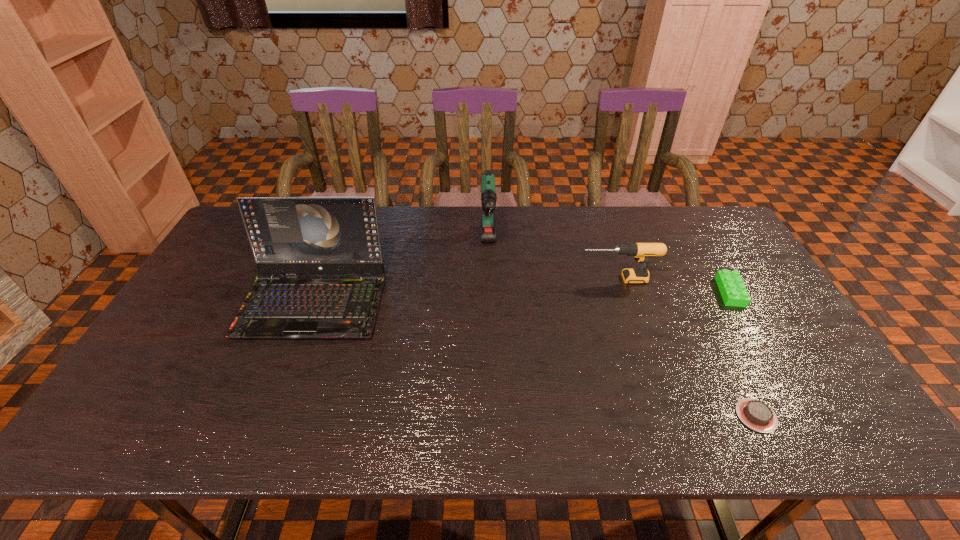
Where is `vacant space that satisfies the following two spatial constraints: 1. on the screen of the second object from right to left; 2. on the left side of the laptop computer`? This screenshot has width=960, height=540. vacant space that satisfies the following two spatial constraints: 1. on the screen of the second object from right to left; 2. on the left side of the laptop computer is located at coordinates (272, 415).

Identify the location of vacant space that satisfies the following two spatial constraints: 1. on the handle side of the third tallest object; 2. on the screen of the leftmost object. This screenshot has width=960, height=540. (625, 301).